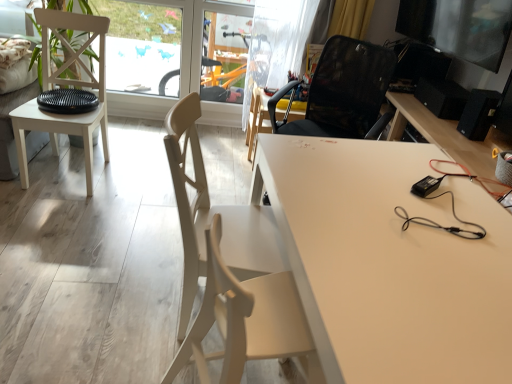
Identify the location of black matte speaker at right. Image resolution: width=512 pixels, height=384 pixels. (478, 114).

What is the approximate width of white matte chair at left, which is the second chair from back to front?

It is 55.30 centimeters.

The width and height of the screenshot is (512, 384). Find the location of `transparent plastic window screen at upper left`. transparent plastic window screen at upper left is located at coordinates (140, 44).

Measure the distance between point (202, 168) and camera.

They are 5.38 feet apart.

Describe the element at coordinates (460, 27) in the screenshot. I see `metallic glossy monitor at upper right` at that location.

Find the location of a particular element. The image size is (512, 384). white matte desk at center is located at coordinates (390, 262).

Is matte white chair at center, which ranks as the 2th chair in front-to-back order, located outside black matte speaker at right?

Yes.

In terms of size, does matte white chair at center, marked as the third chair in a back-to-front arrangement, appear bigger or smaller than black matte speaker at right?

Clearly, matte white chair at center, marked as the third chair in a back-to-front arrangement, is larger in size than black matte speaker at right.

Is matte white chair at center, which ranks as the 2th chair in front-to-back order, facing towards black matte speaker at right?

No, matte white chair at center, which ranks as the 2th chair in front-to-back order, is not facing towards black matte speaker at right.

How different are the orientations of matte white chair at center, which ranks as the 2th chair in front-to-back order, and black matte speaker at right in degrees?

167 degrees separate the facing orientations of matte white chair at center, which ranks as the 2th chair in front-to-back order, and black matte speaker at right.

Considering the positions of point (444, 376) and point (42, 49), is point (444, 376) closer or farther from the camera than point (42, 49)?

Point (444, 376).

Which of these two, white matte desk at center or white matte chair at left, which appears as the third chair when viewed from the front, is bigger?

white matte desk at center.

Which of these two, white matte desk at center or white matte chair at left, which appears as the third chair when viewed from the front, is wider?

white matte desk at center is wider.

From the image's perspective, does black mesh chair at center, placed as the 4th chair when sorted from front to back, appear higher than transparent plastic screen door at upper center?

No, from the image's perspective, black mesh chair at center, placed as the 4th chair when sorted from front to back, is not on top of transparent plastic screen door at upper center.

From a real-world perspective, is black mesh chair at center, which appears as the first chair when viewed from the back, physically below transparent plastic screen door at upper center?

Yes, from a real-world perspective, black mesh chair at center, which appears as the first chair when viewed from the back, is beneath transparent plastic screen door at upper center.

Would you say black mesh chair at center, placed as the 4th chair when sorted from front to back, contains transparent plastic screen door at upper center?

No.

Is black mesh chair at center, which appears as the first chair when viewed from the back, oriented towards transparent plastic screen door at upper center?

No, black mesh chair at center, which appears as the first chair when viewed from the back, is not oriented towards transparent plastic screen door at upper center.

Considering the positions of point (197, 47) and point (116, 17), is point (197, 47) closer or farther from the camera than point (116, 17)?

Clearly, point (197, 47) is more distant from the camera than point (116, 17).

From the image's perspective, is transparent plastic screen door at upper center located above transparent plastic window screen at upper left?

No, from the image's perspective, transparent plastic screen door at upper center is not above transparent plastic window screen at upper left.

Is transparent plastic screen door at upper center bigger or smaller than transparent plastic window screen at upper left?

Clearly, transparent plastic screen door at upper center is smaller in size than transparent plastic window screen at upper left.

How far apart are transparent plastic screen door at upper center and transparent plastic window screen at upper left?

They are 19.54 inches apart.

At what (x,y) coordinates should I click in order to perform the action: click on chair that is behind the white matte chair at left, which is the second chair from back to front. Please return your answer as a coordinate pair (x, y). The image size is (512, 384). Looking at the image, I should click on (269, 113).

Can you confirm if black mesh chair at center, placed as the 4th chair when sorted from front to back, is thinner than white matte chair at left, which is the second chair from back to front?

Correct, the width of black mesh chair at center, placed as the 4th chair when sorted from front to back, is less than that of white matte chair at left, which is the second chair from back to front.

Considering the relative sizes of black mesh chair at center, which appears as the first chair when viewed from the back, and white matte chair at left, which appears as the third chair when viewed from the front, in the image provided, is black mesh chair at center, which appears as the first chair when viewed from the back, smaller than white matte chair at left, which appears as the third chair when viewed from the front,?

Yes.

Is black mesh chair at center, placed as the 4th chair when sorted from front to back, not near white matte chair at left, which is the second chair from back to front?

That's right, there is a large distance between black mesh chair at center, placed as the 4th chair when sorted from front to back, and white matte chair at left, which is the second chair from back to front.

From the image's perspective, does black matte speaker at right appear lower than black mesh chair at center, placed as the 4th chair when sorted from front to back?

Yes, from the image's perspective, black matte speaker at right is below black mesh chair at center, placed as the 4th chair when sorted from front to back.

Which of these two, black matte speaker at right or black mesh chair at center, which appears as the first chair when viewed from the back, stands taller?

Standing taller between the two is black mesh chair at center, which appears as the first chair when viewed from the back.

Can you confirm if black matte speaker at right is wider than black mesh chair at center, placed as the 4th chair when sorted from front to back?

No, black matte speaker at right is not wider than black mesh chair at center, placed as the 4th chair when sorted from front to back.

From the image's perspective, starting from the black matte speaker at right, which chair is the 1st one above? Please provide its 2D coordinates.

[(269, 113)]

Is light beige wood chair at center, which is counted as the fourth chair, starting from the back, to the left of matte white chair at center, which ranks as the 2th chair in front-to-back order, from the viewer's perspective?

In fact, light beige wood chair at center, which is counted as the fourth chair, starting from the back, is to the right of matte white chair at center, which ranks as the 2th chair in front-to-back order.

The image size is (512, 384). I want to click on chair that is the 2nd one above the light beige wood chair at center, which is counted as the fourth chair, starting from the back (from a real-world perspective), so click(x=213, y=214).

Can you see light beige wood chair at center, which is counted as the fourth chair, starting from the back, touching matte white chair at center, marked as the third chair in a back-to-front arrangement?

No, light beige wood chair at center, which is counted as the fourth chair, starting from the back, is not with matte white chair at center, marked as the third chair in a back-to-front arrangement.

Between light beige wood chair at center, acting as the first chair starting from the front, and matte white chair at center, which ranks as the 2th chair in front-to-back order, which one has smaller size?

With smaller size is light beige wood chair at center, acting as the first chair starting from the front.

Where is `speaker above the matte white chair at center, which ranks as the 2th chair in front-to-back order (from the image's perspective)`? Image resolution: width=512 pixels, height=384 pixels. speaker above the matte white chair at center, which ranks as the 2th chair in front-to-back order (from the image's perspective) is located at coordinates (478, 114).

Identify the location of desk lying on the right of white matte chair at left, which is the second chair from back to front. (390, 262).

From the picture: Looking at the image, which one is located closer to light beige wood chair at center, acting as the first chair starting from the front, white matte chair at left, which appears as the third chair when viewed from the front, or white matte desk at center?

white matte desk at center lies closer to light beige wood chair at center, acting as the first chair starting from the front, than the other object.

When comparing their distances from light beige wood chair at center, acting as the first chair starting from the front, does white matte desk at center or metallic glossy monitor at upper right seem closer?

white matte desk at center is positioned closer to the anchor light beige wood chair at center, acting as the first chair starting from the front.

Looking at the image, which one is located closer to black mesh chair at center, which appears as the first chair when viewed from the back, transparent plastic screen door at upper center or metallic glossy monitor at upper right?

transparent plastic screen door at upper center lies closer to black mesh chair at center, which appears as the first chair when viewed from the back, than the other object.

Considering their positions, is black matte speaker at right positioned closer to matte white chair at center, marked as the third chair in a back-to-front arrangement, than white matte chair at left, which appears as the third chair when viewed from the front?

The object closer to matte white chair at center, marked as the third chair in a back-to-front arrangement, is white matte chair at left, which appears as the third chair when viewed from the front.

Which object lies further to the anchor point transparent plastic window screen at upper left, black mesh chair at center, which appears as the first chair when viewed from the back, or black matte speaker at right?

Based on the image, black matte speaker at right appears to be further to transparent plastic window screen at upper left.

Considering their positions, is matte white chair at center, marked as the third chair in a back-to-front arrangement, positioned closer to transparent plastic window screen at upper left than white matte desk at center?

matte white chair at center, marked as the third chair in a back-to-front arrangement, is closer to transparent plastic window screen at upper left.

Estimate the real-world distances between objects in this image. Which object is closer to transparent plastic window screen at upper left, white matte desk at center or white matte chair at left, which appears as the third chair when viewed from the front?

white matte chair at left, which appears as the third chair when viewed from the front, is closer to transparent plastic window screen at upper left.

From the picture: Based on their spatial positions, is transparent plastic window screen at upper left or metallic glossy monitor at upper right closer to black matte speaker at right?

Among the two, metallic glossy monitor at upper right is located nearer to black matte speaker at right.

This screenshot has height=384, width=512. In order to click on computer monitor situated between transparent plastic window screen at upper left and black matte speaker at right from left to right in this screenshot , I will do [x=460, y=27].

The height and width of the screenshot is (384, 512). Identify the location of window screen between white matte chair at left, which appears as the third chair when viewed from the front, and transparent plastic screen door at upper center from front to back. (140, 44).

At what (x,y) coordinates should I click in order to perform the action: click on desk between metallic glossy monitor at upper right and light beige wood chair at center, which is counted as the fourth chair, starting from the back, from top to bottom. Please return your answer as a coordinate pair (x, y). This screenshot has height=384, width=512. Looking at the image, I should click on (390, 262).

The width and height of the screenshot is (512, 384). I want to click on computer monitor located between black mesh chair at center, which appears as the first chair when viewed from the back, and black matte speaker at right in the left-right direction, so click(460, 27).